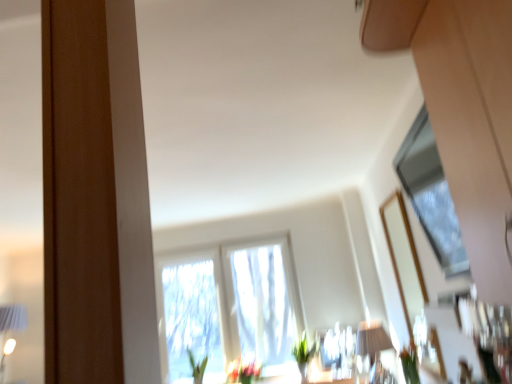
Question: Could you tell me if green matte plant at lower right, which is the 2th plant from left to right, is facing translucent fabric window at center, the 1th window in the back-to-front sequence?

Choices:
 (A) yes
 (B) no

Answer: (B)

Question: Considering the relative positions of green matte plant at lower right, which is the 2th plant from left to right, and translucent fabric window at center, arranged as the 1th window when ordered from the bottom, in the image provided, is green matte plant at lower right, which is the 2th plant from left to right, in front of translucent fabric window at center, arranged as the 1th window when ordered from the bottom,?

Choices:
 (A) yes
 (B) no

Answer: (A)

Question: Can translucent fabric window at center, the 1th window in the back-to-front sequence, be found inside green matte plant at lower right, acting as the second plant starting from the bottom?

Choices:
 (A) yes
 (B) no

Answer: (B)

Question: Is green matte plant at lower right, acting as the second plant starting from the bottom, at the left side of translucent fabric window at center, the 2th window positioned from the right?

Choices:
 (A) no
 (B) yes

Answer: (A)

Question: Is green matte plant at lower right, positioned as the 1th plant in front-to-back order, next to translucent fabric window at center, the 1th window in the back-to-front sequence, and touching it?

Choices:
 (A) no
 (B) yes

Answer: (A)

Question: Is translucent fabric window at center, the 1th window in the back-to-front sequence, situated inside translucent glass vase at center or outside?

Choices:
 (A) inside
 (B) outside

Answer: (B)

Question: Considering the positions of point (159, 294) and point (256, 367), is point (159, 294) closer or farther from the camera than point (256, 367)?

Choices:
 (A) closer
 (B) farther

Answer: (A)

Question: In terms of width, does translucent fabric window at center, the 1th window in the back-to-front sequence, look wider or thinner when compared to translucent glass vase at center?

Choices:
 (A) thin
 (B) wide

Answer: (A)

Question: From a real-world perspective, is translucent fabric window at center, the 1th window in the back-to-front sequence, physically located above or below translucent glass vase at center?

Choices:
 (A) above
 (B) below

Answer: (A)

Question: From the image's perspective, is green matte vase at lower center, which ranks as the first plant in bottom-to-top order, located above or below translucent glass vase at center?

Choices:
 (A) above
 (B) below

Answer: (A)

Question: From a real-world perspective, is green matte vase at lower center, the second plant positioned from the front, positioned above or below translucent glass vase at center?

Choices:
 (A) below
 (B) above

Answer: (B)

Question: Visually, is green matte vase at lower center, which ranks as the first plant in bottom-to-top order, positioned to the left or to the right of translucent glass vase at center?

Choices:
 (A) right
 (B) left

Answer: (A)

Question: From their relative heights in the image, would you say green matte vase at lower center, acting as the 1th plant starting from the back, is taller or shorter than translucent glass vase at center?

Choices:
 (A) tall
 (B) short

Answer: (A)

Question: Is green matte vase at lower center, marked as the 2th plant in a right-to-left arrangement, bigger or smaller than matte white table lamp at lower center?

Choices:
 (A) big
 (B) small

Answer: (B)

Question: From the image's perspective, relative to matte white table lamp at lower center, is green matte vase at lower center, the second plant positioned from the front, above or below?

Choices:
 (A) below
 (B) above

Answer: (A)